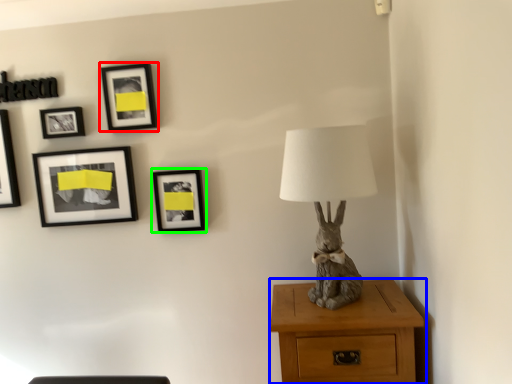
Question: Which object is positioned closest to picture frame (highlighted by a red box)? Select from nightstand (highlighted by a blue box) and picture frame (highlighted by a green box).

Choices:
 (A) nightstand
 (B) picture frame

Answer: (B)